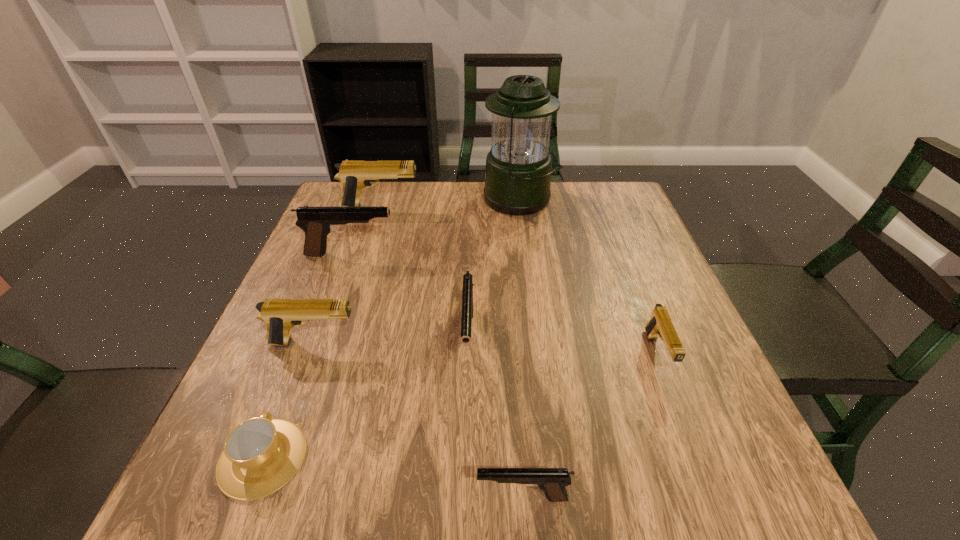
Locate an element on the screen. The width and height of the screenshot is (960, 540). cup that is at the near edge is located at coordinates (260, 455).

Where is `cup at the left edge`? cup at the left edge is located at coordinates (260, 455).

Find the location of a particular element. Image resolution: width=960 pixels, height=540 pixels. object located in the right edge section of the desktop is located at coordinates (660, 325).

At what (x,y) coordinates should I click in order to perform the action: click on object present at the far left corner. Please return your answer as a coordinate pair (x, y). Looking at the image, I should click on (354, 175).

Find the location of a particular element. The image size is (960, 540). object that is positioned at the near left corner is located at coordinates (260, 455).

At what (x,y) coordinates should I click in order to perform the action: click on vacant area at the far edge of the desktop. Please return your answer as a coordinate pair (x, y). Looking at the image, I should click on (402, 199).

This screenshot has width=960, height=540. Identify the location of free spot at the near edge of the desktop. (365, 489).

You are a GUI agent. You are given a task and a screenshot of the screen. Output one action in this format:
    pyautogui.click(x=<x>, y=<y>)
    Task: Click on the vacant point at the left edge
    The width and height of the screenshot is (960, 540).
    Given the screenshot: What is the action you would take?
    pyautogui.click(x=343, y=249)

The width and height of the screenshot is (960, 540). Find the location of `free space at the right edge`. free space at the right edge is located at coordinates (635, 294).

This screenshot has width=960, height=540. In the image, there is a desktop. Find the location of `vacant space at the far left corner`. vacant space at the far left corner is located at coordinates (339, 188).